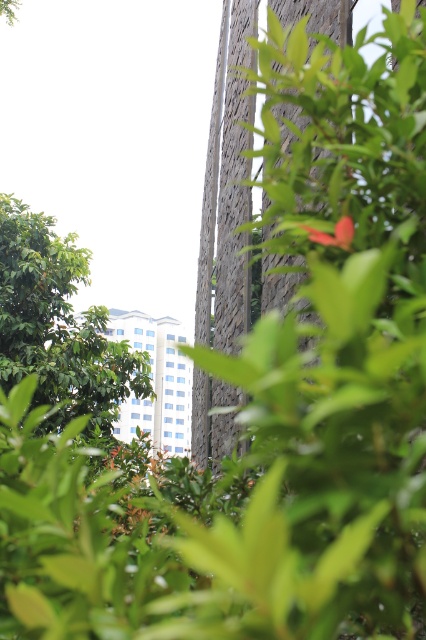
You are an artist planning to paint this scene. You want to ensure the green leafy tree at lower left and the matte red flower at center are proportionally accurate. Which object should you paint wider in your artwork?

The green leafy tree at lower left should be painted wider than the matte red flower at center because its width is larger according to the description.

You are a photographer trying to capture the matte red flower at center without the green leafy tree at lower left blocking it. Based on their positions, is this possible?

The green leafy tree at lower left is positioned on the left side of the matte red flower at center, so if you move to the right side of the flower, you can avoid the tree and capture it without obstruction.

You are standing in a garden and want to take a photo of the green leafy tree at lower left. If your camera has a maximum focus range of 15 meters, will it be able to focus on the tree?

The distance of the green leafy tree at lower left from the camera is 14.16 meters, which is within the camera maximum focus range of 15 meters. Therefore, the camera can focus on the green leafy tree at lower left.